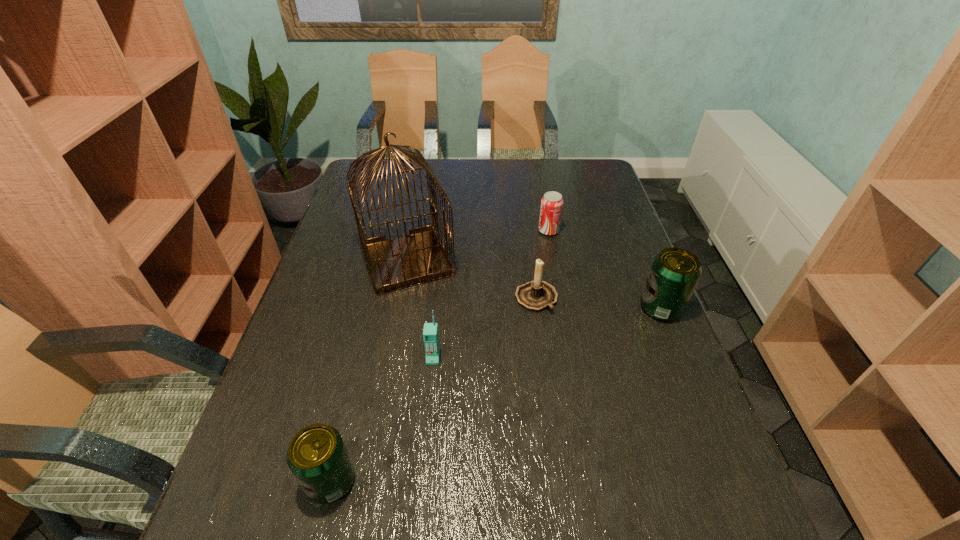
Please point a spot to place another beer_can for symmetrical spacing. Please provide its 2D coordinates. Your answer should be formatted as a tuple, i.e. [(x, y)], where the tuple contains the x and y coordinates of a point satisfying the conditions above.

[(522, 380)]